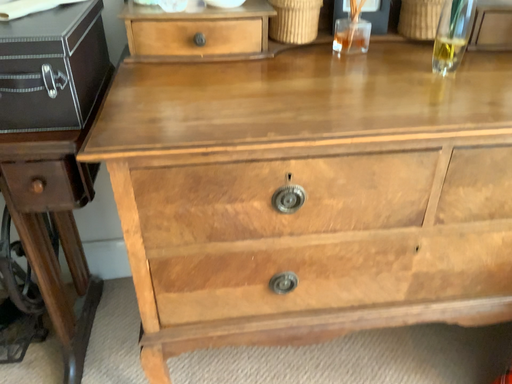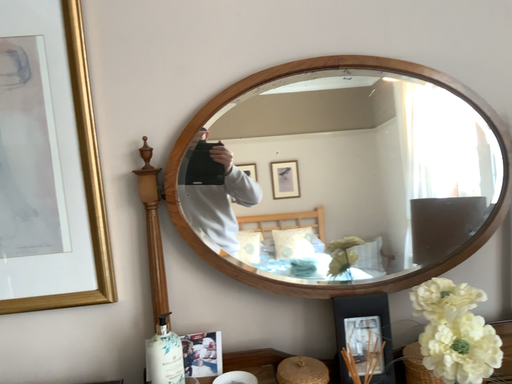
Question: How did the camera likely rotate when shooting the video?

Choices:
 (A) rotated downward
 (B) rotated upward

Answer: (B)